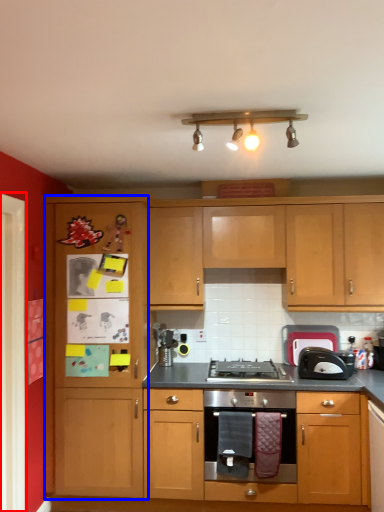
Question: Which of the following is the farthest to the observer, glass door (highlighted by a red box) or file cabinet (highlighted by a blue box)?

Choices:
 (A) glass door
 (B) file cabinet

Answer: (B)